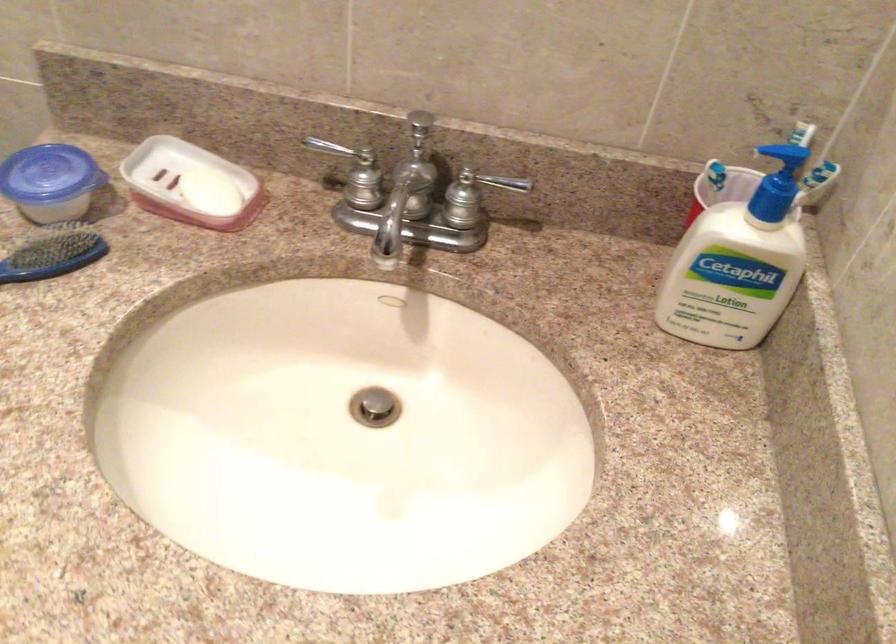
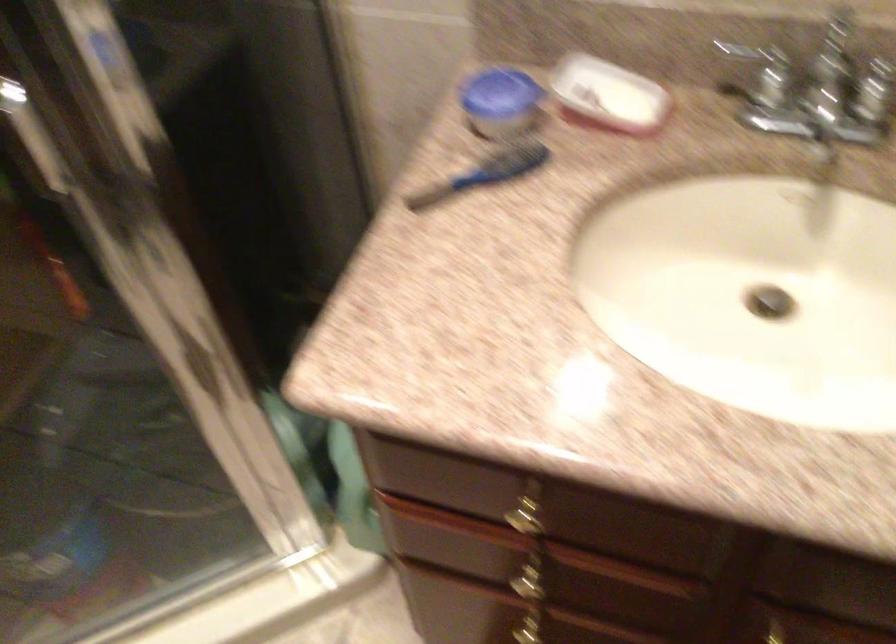
In a continuous first-person perspective shot, in which direction is the camera moving?

The movement direction of the cameraman is left, backward.